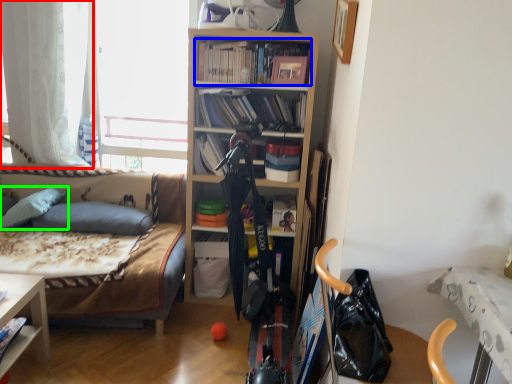
Question: Which object is positioned closest to curtain (highlighted by a red box)? Select from book (highlighted by a blue box) and pillow (highlighted by a green box).

Choices:
 (A) book
 (B) pillow

Answer: (B)